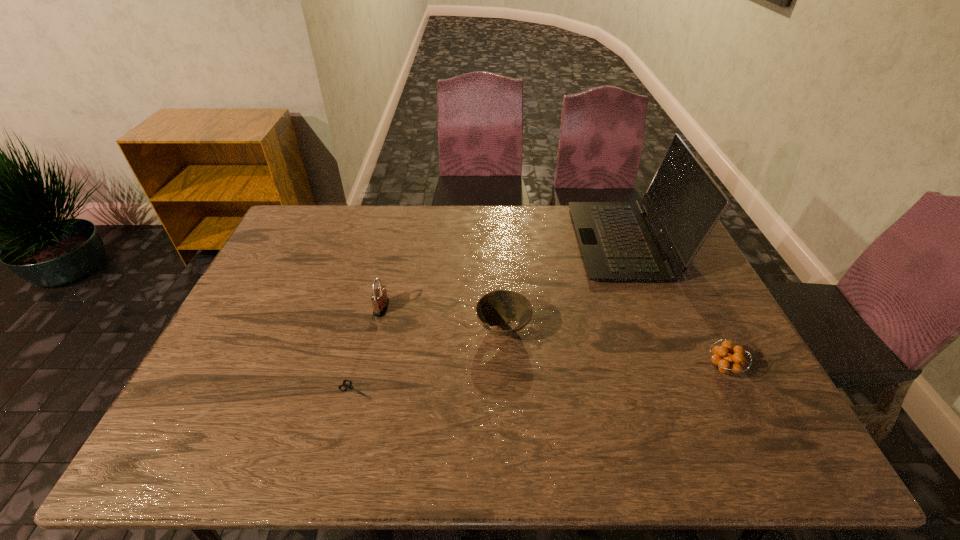
At what (x,y) coordinates should I click in order to perform the action: click on vacant space located on the back of the third object from left to right. Please return your answer as a coordinate pair (x, y). The image size is (960, 540). Looking at the image, I should click on (500, 268).

This screenshot has width=960, height=540. What are the coordinates of `free spot located on the left of the orange fruit` in the screenshot? It's located at [x=559, y=368].

Where is `vacant space located 0.050m on the front of the shortest object`? vacant space located 0.050m on the front of the shortest object is located at coordinates (348, 418).

This screenshot has width=960, height=540. I want to click on object at the far edge, so click(x=618, y=243).

Identify the location of laptop computer positioned at the right edge. (618, 243).

At what (x,y) coordinates should I click in order to perform the action: click on orange fruit located in the right edge section of the desktop. Please return your answer as a coordinate pair (x, y). Looking at the image, I should click on (727, 362).

Locate an element on the screen. This screenshot has height=540, width=960. object that is at the far right corner is located at coordinates (618, 243).

Where is `vacant space at the far edge`? This screenshot has height=540, width=960. vacant space at the far edge is located at coordinates (461, 222).

Find the location of a particular element. vacant space at the near edge of the desktop is located at coordinates (443, 438).

Image resolution: width=960 pixels, height=540 pixels. I want to click on free space at the left edge of the desktop, so click(x=252, y=338).